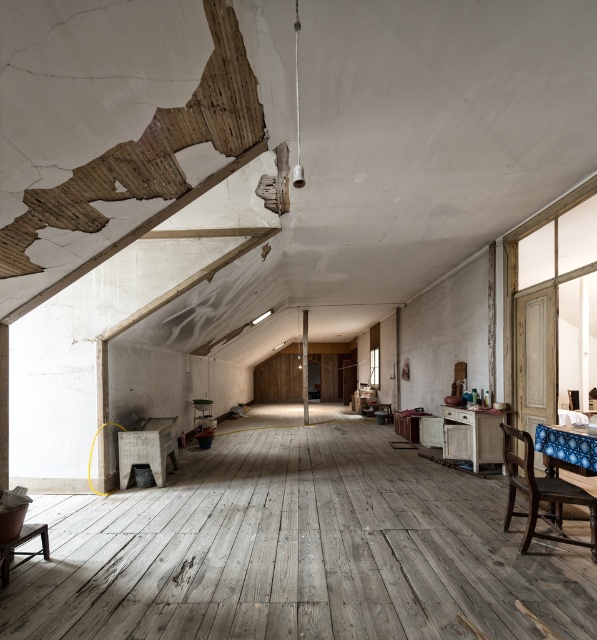
Question: Among these objects, which one is farthest from the camera?

Choices:
 (A) dark wood chair at lower right
 (B) wooden beam at center

Answer: (B)

Question: Among these points, which one is nearest to the camera?

Choices:
 (A) (303, 310)
 (B) (195, 401)
 (C) (510, 436)

Answer: (C)

Question: Can you confirm if dark wood chair at lower right is positioned to the left of wooden stool at center?

Choices:
 (A) no
 (B) yes

Answer: (A)

Question: Which object is closer to the camera taking this photo?

Choices:
 (A) dark wood chair at lower right
 (B) wooden beam at center
 (C) wooden stool at center

Answer: (A)

Question: Is dark wood chair at lower right to the left of wooden beam at center from the viewer's perspective?

Choices:
 (A) no
 (B) yes

Answer: (A)

Question: Can you confirm if dark wood chair at lower right is thinner than wooden stool at center?

Choices:
 (A) yes
 (B) no

Answer: (B)